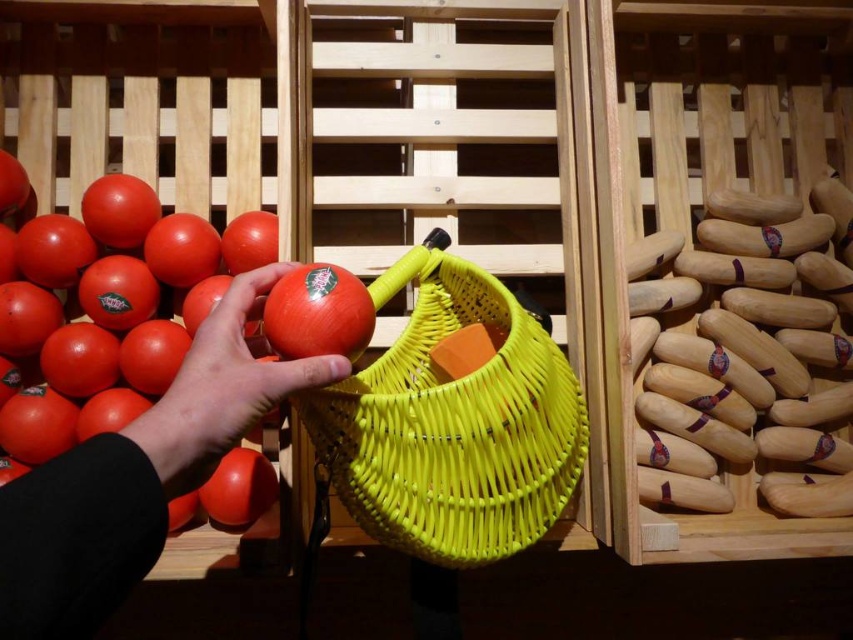
Can you confirm if matte orange tomato at center is wider than glossy plastic tomato at lower left?

Yes, matte orange tomato at center is wider than glossy plastic tomato at lower left.

The width and height of the screenshot is (853, 640). In order to click on matte orange tomato at center in this screenshot , I will do `click(221, 388)`.

Does glossy orange tomato at center appear on the left side of glossy plastic tomato at lower left?

In fact, glossy orange tomato at center is to the right of glossy plastic tomato at lower left.

Does glossy orange tomato at center have a greater width compared to glossy plastic tomato at lower left?

No.

Find the location of a particular element. Image resolution: width=853 pixels, height=640 pixels. glossy orange tomato at center is located at coordinates (318, 314).

The height and width of the screenshot is (640, 853). I want to click on glossy orange tomato at center, so click(318, 314).

Between point (234, 349) and point (300, 304), which one is positioned in front?

Point (234, 349) is more forward.

Does matte orange tomato at center have a larger size compared to glossy orange tomato at center?

Yes, matte orange tomato at center is bigger than glossy orange tomato at center.

Identify the location of matte orange tomato at center. (221, 388).